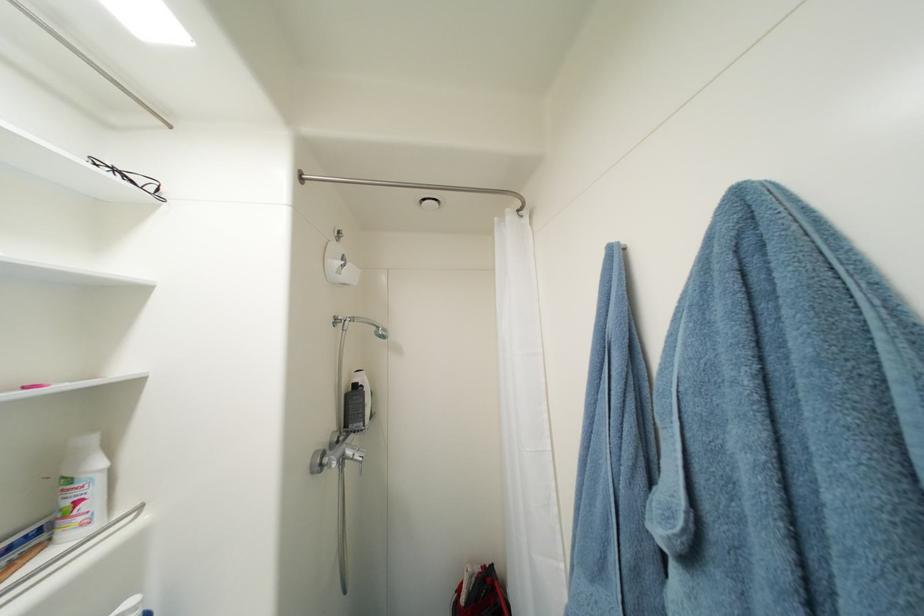
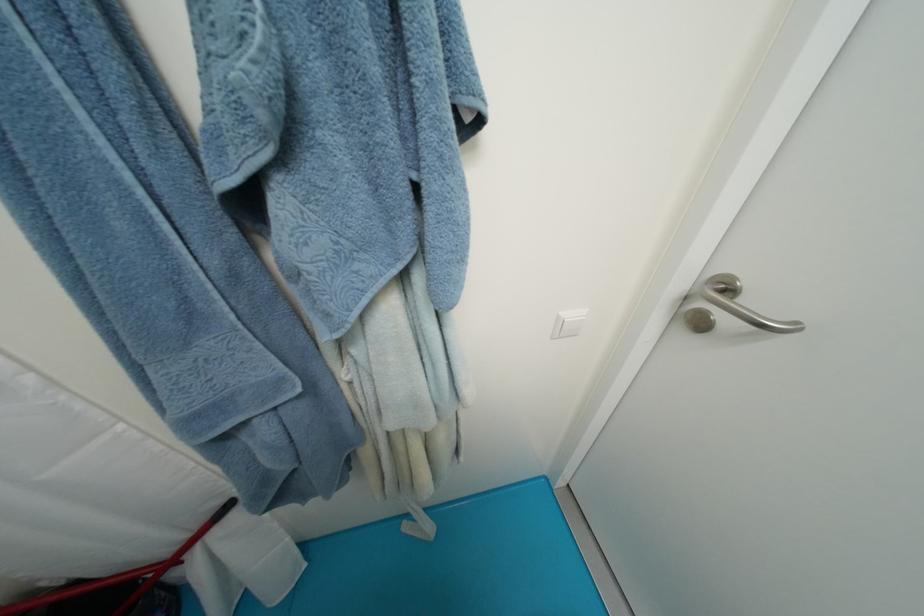
How did the camera likely rotate?

The camera rotated toward right-down.